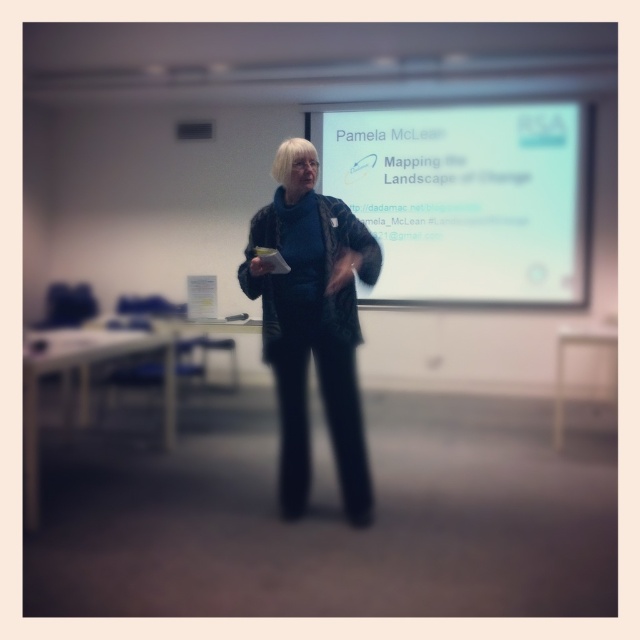
Can you confirm if white glossy projector screen at upper center is positioned above black textured jacket at center?

Indeed, white glossy projector screen at upper center is positioned over black textured jacket at center.

Does white glossy projector screen at upper center appear on the left side of black textured jacket at center?

Incorrect, white glossy projector screen at upper center is not on the left side of black textured jacket at center.

Which is behind, point (557, 243) or point (288, 320)?

Positioned behind is point (557, 243).

Image resolution: width=640 pixels, height=640 pixels. Identify the location of white glossy projector screen at upper center. (467, 196).